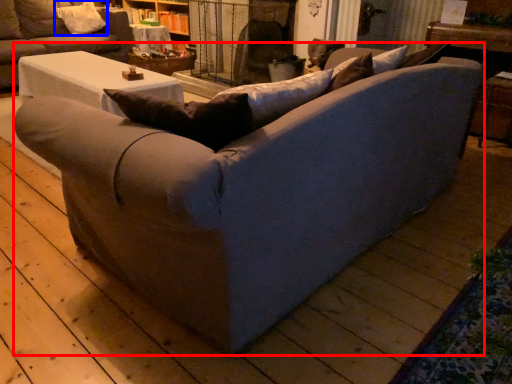
Question: Which of the following is the closest to the observer, studio couch (highlighted by a red box) or pillow (highlighted by a blue box)?

Choices:
 (A) studio couch
 (B) pillow

Answer: (A)